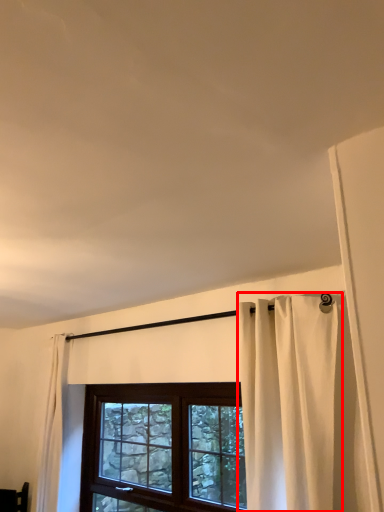
Question: Observing the image, what is the correct spatial positioning of curtain (annotated by the red box) in reference to window?

Choices:
 (A) right
 (B) left

Answer: (A)